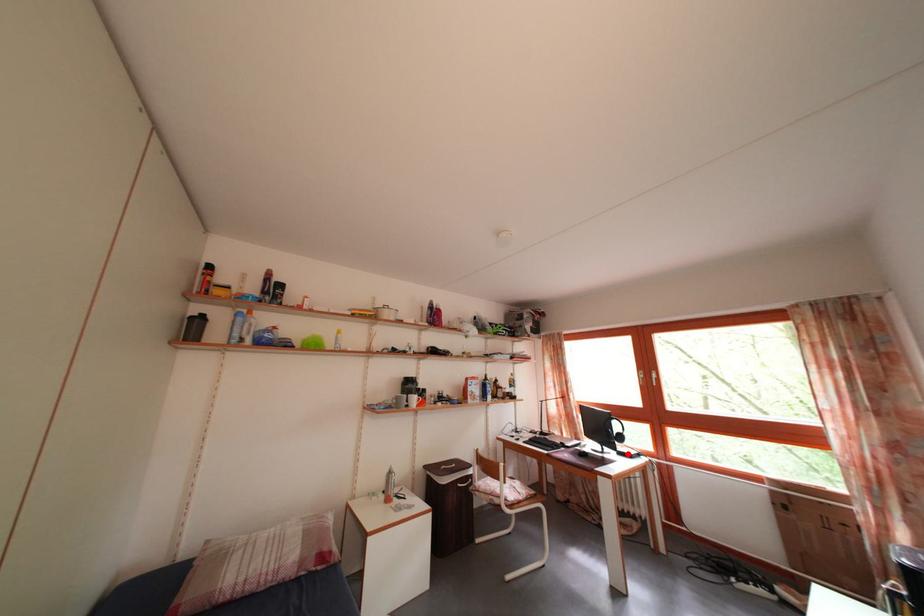
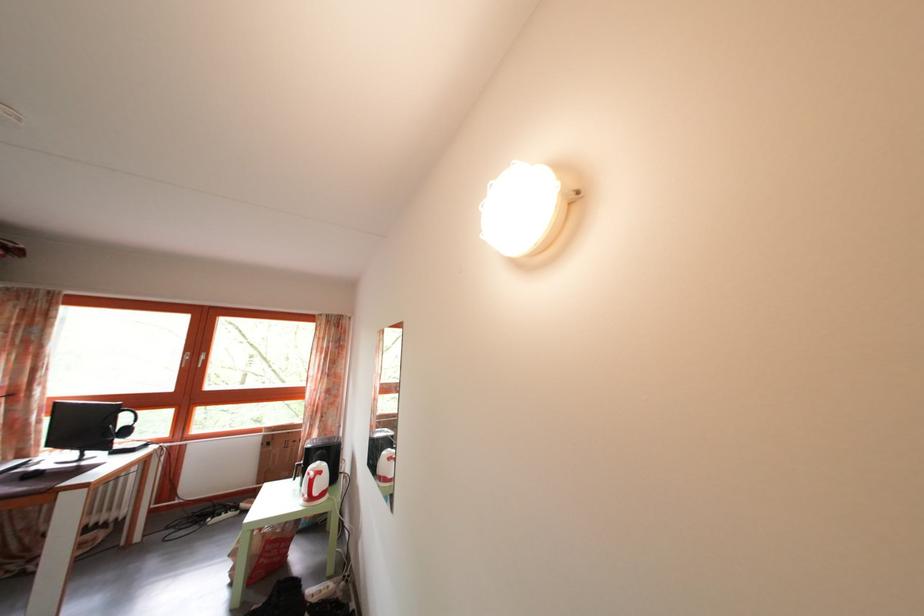
Locate, in the second image, the point that corresponds to the highlighted location in the first image.

(128, 451)